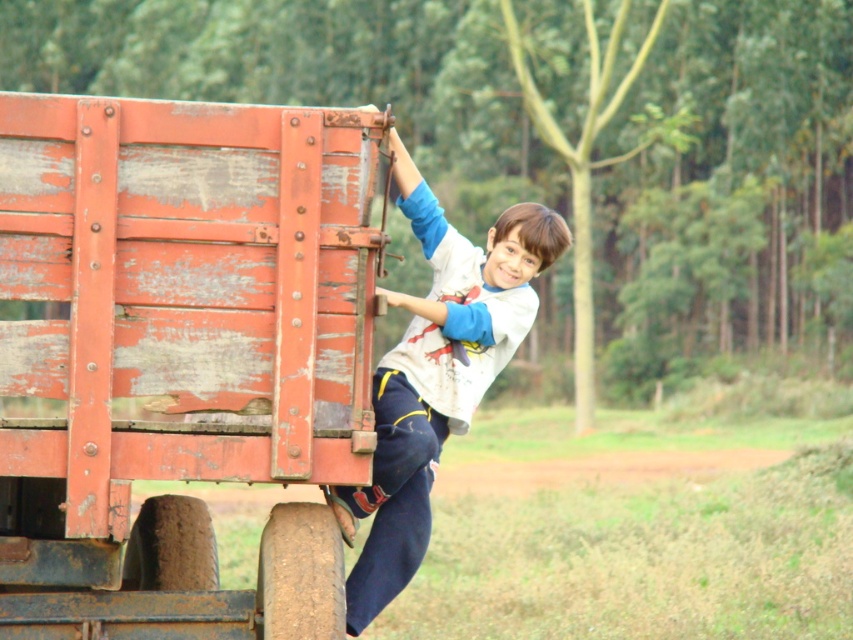
Question: Does rusty wood wagon at left appear under white cotton shirt at center?

Choices:
 (A) no
 (B) yes

Answer: (B)

Question: Can you confirm if rusty wood wagon at left is bigger than white cotton shirt at center?

Choices:
 (A) no
 (B) yes

Answer: (B)

Question: Considering the relative positions of rusty wood wagon at left and white cotton shirt at center in the image provided, where is rusty wood wagon at left located with respect to white cotton shirt at center?

Choices:
 (A) above
 (B) below

Answer: (B)

Question: Among these points, which one is farthest from the camera?

Choices:
 (A) (543, 246)
 (B) (3, 580)

Answer: (A)

Question: Among these objects, which one is nearest to the camera?

Choices:
 (A) rusty wood wagon at left
 (B) white cotton shirt at center

Answer: (A)

Question: Which point is farther to the camera?

Choices:
 (A) (492, 342)
 (B) (196, 269)

Answer: (A)